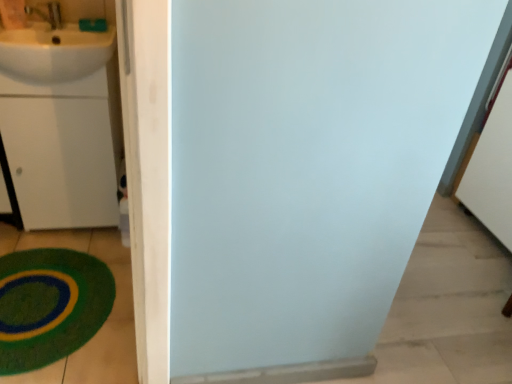
Question: Considering the relative positions of white glossy sink at upper left and green plush bath mat at lower left in the image provided, is white glossy sink at upper left in front of green plush bath mat at lower left?

Choices:
 (A) yes
 (B) no

Answer: (B)

Question: Considering the relative sizes of white glossy sink at upper left and green plush bath mat at lower left in the image provided, is white glossy sink at upper left shorter than green plush bath mat at lower left?

Choices:
 (A) no
 (B) yes

Answer: (A)

Question: From the image's perspective, is white glossy sink at upper left below green plush bath mat at lower left?

Choices:
 (A) no
 (B) yes

Answer: (A)

Question: Can you confirm if white glossy sink at upper left is wider than green plush bath mat at lower left?

Choices:
 (A) no
 (B) yes

Answer: (A)

Question: Considering the relative sizes of white glossy sink at upper left and green plush bath mat at lower left in the image provided, is white glossy sink at upper left bigger than green plush bath mat at lower left?

Choices:
 (A) yes
 (B) no

Answer: (A)

Question: From a real-world perspective, is white glossy sink at upper left positioned over green plush bath mat at lower left based on gravity?

Choices:
 (A) no
 (B) yes

Answer: (B)

Question: Can you confirm if green plush bath mat at lower left is bigger than white matte drawer at left?

Choices:
 (A) no
 (B) yes

Answer: (A)

Question: Is green plush bath mat at lower left facing away from white matte drawer at left?

Choices:
 (A) yes
 (B) no

Answer: (B)

Question: Can white matte drawer at left be found inside green plush bath mat at lower left?

Choices:
 (A) no
 (B) yes

Answer: (A)

Question: Is green plush bath mat at lower left smaller than white matte drawer at left?

Choices:
 (A) no
 (B) yes

Answer: (B)

Question: Is green plush bath mat at lower left at the left side of white matte drawer at left?

Choices:
 (A) no
 (B) yes

Answer: (A)

Question: Is green plush bath mat at lower left to the right of white matte drawer at left from the viewer's perspective?

Choices:
 (A) no
 (B) yes

Answer: (B)

Question: Can we say green plush bath mat at lower left lies outside white glossy sink at upper left?

Choices:
 (A) no
 (B) yes

Answer: (B)